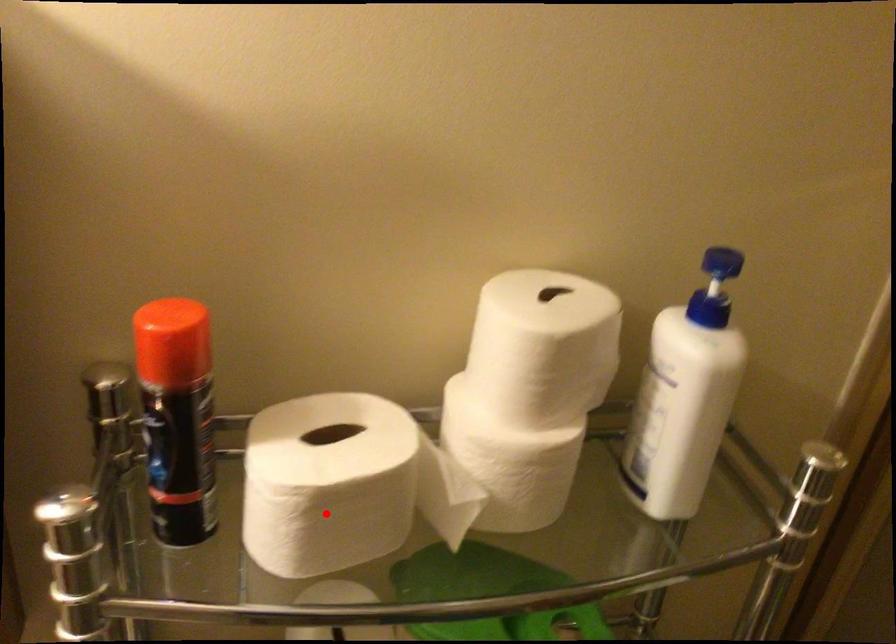
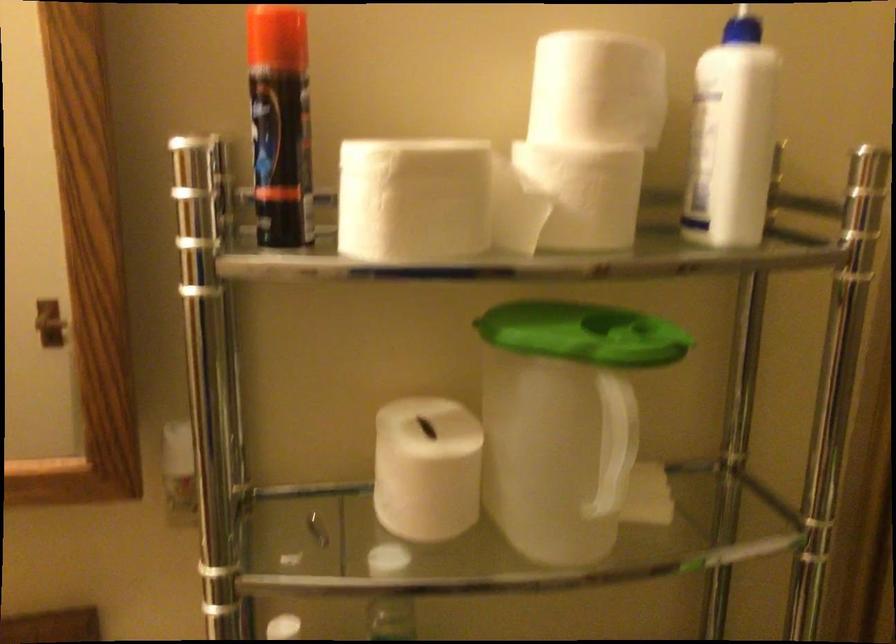
Question: I am providing you with two images of the same scene from different viewpoints. In image1, a red point is highlighted. Considering the same 3D point in image2, which of the following is correct?

Choices:
 (A) It is closer
 (B) It is farther

Answer: (B)